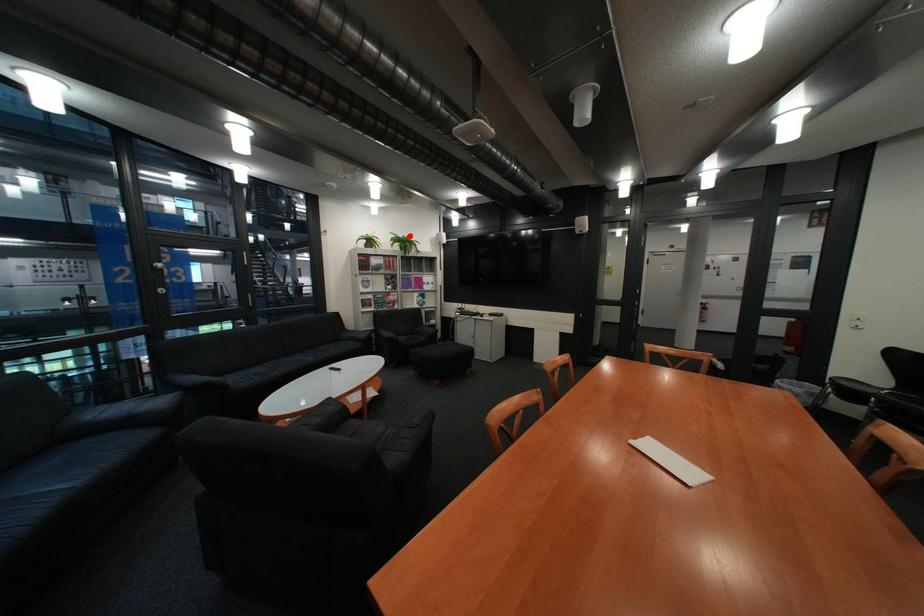
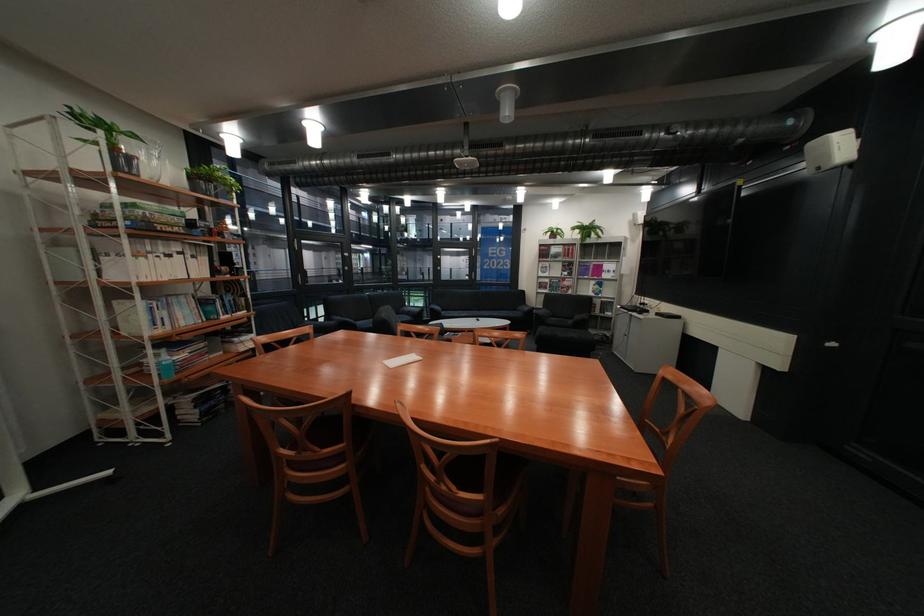
Where in the second image is the point corresponding to the highlighted location from the first image?

(594, 225)